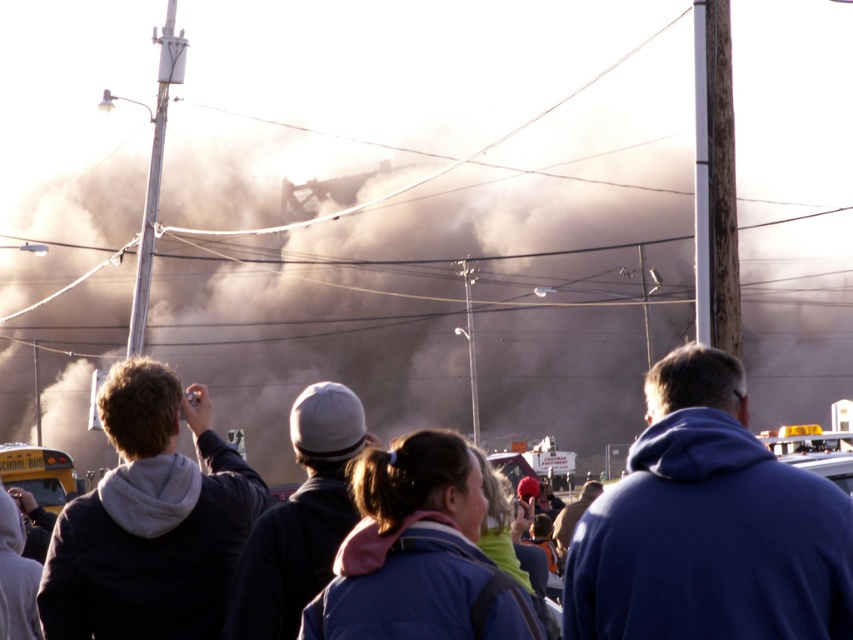
You are a photographer at the scene of the event. You want to capture a photo where both the gray knit cap at center and the yellow painted school bus at lower left are clearly visible. Which object should be placed closer to the camera to ensure both are in focus?

To ensure both the gray knit cap at center and the yellow painted school bus at lower left are in focus, the gray knit cap at center should be placed closer to the camera since it has a smaller width than the yellow painted school bus at lower left, allowing for a greater depth of field when focused on the smaller object.

You are standing at the scene of a large fire with thick smoke billowing in the background. There is a point marked at coordinates (793, 515). If you want to move closer to this point, which direction should you move relative to your current position?

The point at coordinates (793, 515) is 50.06 feet away from you. To move closer to this point, you should move forward towards it.